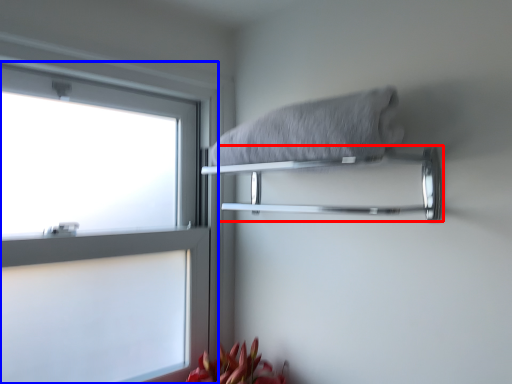
Question: Which object is further to the camera taking this photo, towel bar (highlighted by a red box) or window (highlighted by a blue box)?

Choices:
 (A) towel bar
 (B) window

Answer: (B)